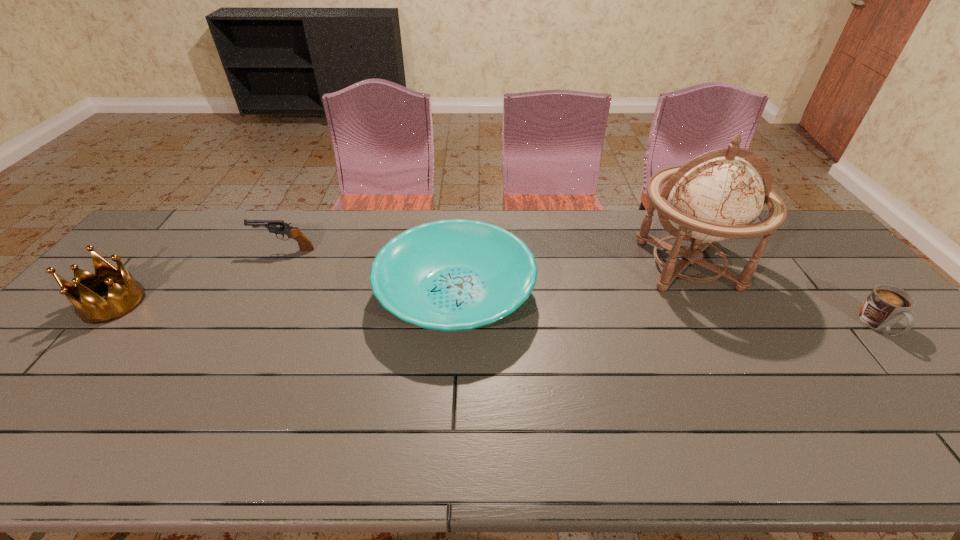
You are a GUI agent. You are given a task and a screenshot of the screen. Output one action in this format:
    pyautogui.click(x=<x>, y=<y>)
    Task: Click on the vacant point located between the mug and the second object from left to right
    Image resolution: width=960 pixels, height=540 pixels.
    Given the screenshot: What is the action you would take?
    pyautogui.click(x=582, y=288)

Find the location of `the third closest object to the mug`. the third closest object to the mug is located at coordinates (274, 226).

Where is `object that is the nearest to the fourth object from right to left`? The height and width of the screenshot is (540, 960). object that is the nearest to the fourth object from right to left is located at coordinates (449, 275).

The image size is (960, 540). In order to click on free region that satisfies the following two spatial constraints: 1. on the back side of the third object from left to right; 2. on the left side of the crown in this screenshot , I will do `click(121, 294)`.

Locate an element on the screen. This screenshot has height=540, width=960. vacant space that satisfies the following two spatial constraints: 1. on the back side of the crown; 2. along the barrel of the gun is located at coordinates (159, 250).